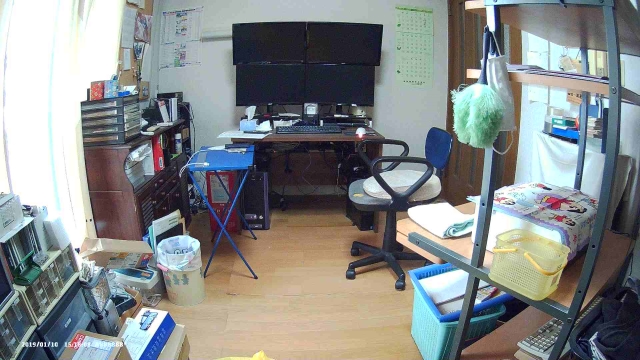
Where is `floor`? The width and height of the screenshot is (640, 360). floor is located at coordinates (320, 318).